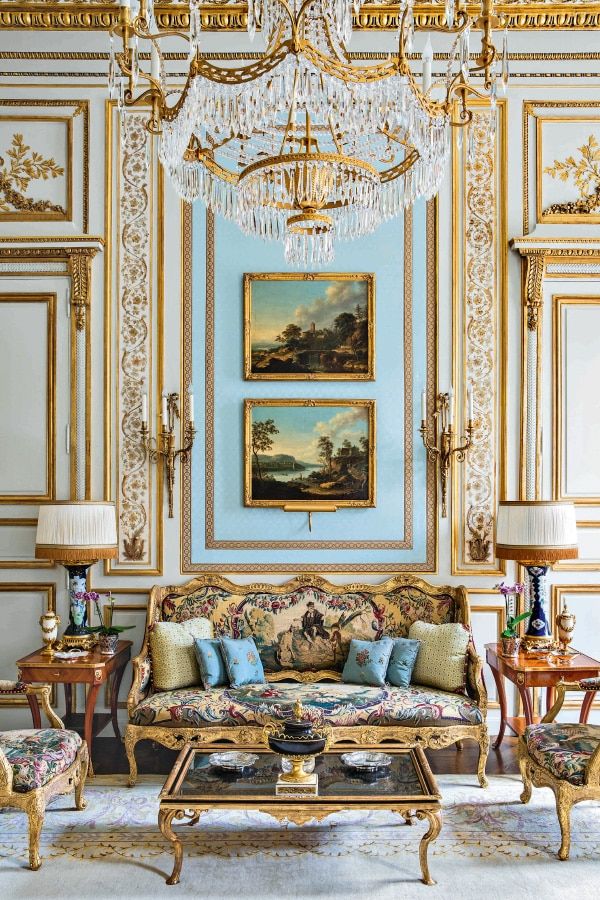
Where is `blue pillows`? The width and height of the screenshot is (600, 900). blue pillows is located at coordinates (242, 663), (213, 664), (365, 661), (393, 660).